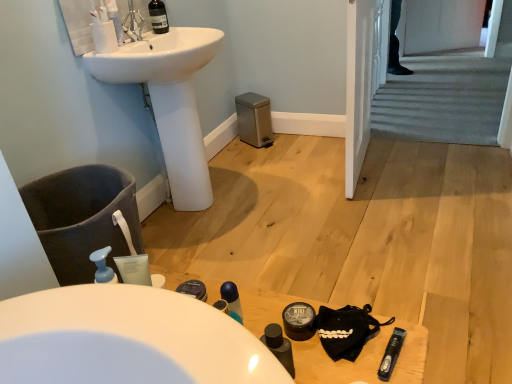
Locate an element on the screen. This screenshot has height=384, width=512. vacant region in front of matte black container at lower center is located at coordinates (x=326, y=357).